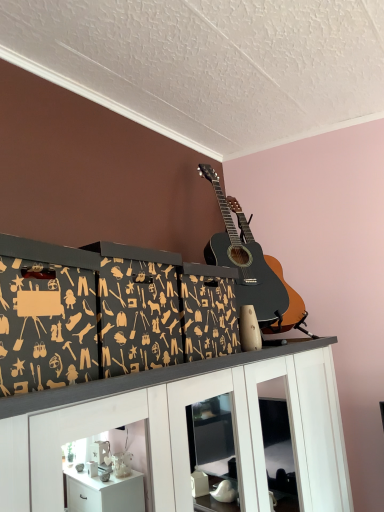
What do you see at coordinates (185, 429) in the screenshot? The height and width of the screenshot is (512, 384). I see `white glossy cabinet at upper center` at bounding box center [185, 429].

Measure the distance between point (237, 295) and camera.

Point (237, 295) and camera are 5.76 feet apart from each other.

Find the location of `black acoustic guitar at upper center`. black acoustic guitar at upper center is located at coordinates (245, 263).

Measure the distance between black cardboard boxes at center and camera.

black cardboard boxes at center is 36.11 inches away from camera.

Find the location of `white glossy cabinet at upper center`. white glossy cabinet at upper center is located at coordinates pos(185,429).

From the image's perspective, which object appears higher, black cardboard boxes at center or white glossy cabinet at upper center?

black cardboard boxes at center, from the image's perspective.

Is point (110, 362) closer or farther from the camera than point (289, 340)?

Clearly, point (110, 362) is closer to the camera than point (289, 340).

Is white glossy cabinet at upper center at the back of black cardboard boxes at center?

No, black cardboard boxes at center is not facing the opposite direction of white glossy cabinet at upper center.

From a real-world perspective, is black cardboard boxes at center positioned under white glossy cabinet at upper center based on gravity?

No, from a real-world perspective, black cardboard boxes at center is not beneath white glossy cabinet at upper center.

Who is taller, black cardboard boxes at center or black acoustic guitar at upper center?

With more height is black acoustic guitar at upper center.

Who is bigger, black cardboard boxes at center or black acoustic guitar at upper center?

black acoustic guitar at upper center.

Is black cardboard boxes at center at the left side of black acoustic guitar at upper center?

Indeed, black cardboard boxes at center is positioned on the left side of black acoustic guitar at upper center.

Is black cardboard boxes at center aimed at black acoustic guitar at upper center?

No, black cardboard boxes at center is not turned towards black acoustic guitar at upper center.

Considering the relative sizes of black acoustic guitar at upper center and white glossy cabinet at upper center in the image provided, is black acoustic guitar at upper center taller than white glossy cabinet at upper center?

No.

Would you say black acoustic guitar at upper center is inside or outside white glossy cabinet at upper center?

black acoustic guitar at upper center is not inside white glossy cabinet at upper center, it's outside.

Is black acoustic guitar at upper center far from white glossy cabinet at upper center?

black acoustic guitar at upper center is near white glossy cabinet at upper center, not far away.

Can you confirm if black acoustic guitar at upper center is bigger than white glossy cabinet at upper center?

Actually, black acoustic guitar at upper center might be smaller than white glossy cabinet at upper center.

Is white glossy cabinet at upper center taller than black acoustic guitar at upper center?

Yes, white glossy cabinet at upper center is taller than black acoustic guitar at upper center.

Considering the positions of objects white glossy cabinet at upper center and black acoustic guitar at upper center in the image provided, who is more to the left, white glossy cabinet at upper center or black acoustic guitar at upper center?

white glossy cabinet at upper center is more to the left.

Is white glossy cabinet at upper center positioned far away from black acoustic guitar at upper center?

They are positioned close to each other.

Can you tell me how much white glossy cabinet at upper center and black cardboard boxes at center differ in facing direction?

1.27 degrees.

Does white glossy cabinet at upper center have a lesser height compared to black cardboard boxes at center?

In fact, white glossy cabinet at upper center may be taller than black cardboard boxes at center.

Between white glossy cabinet at upper center and black cardboard boxes at center, which one has smaller size?

Smaller between the two is black cardboard boxes at center.

Is white glossy cabinet at upper center oriented towards black cardboard boxes at center?

A: No, white glossy cabinet at upper center is not oriented towards black cardboard boxes at center.

How far apart are black acoustic guitar at upper center and black cardboard boxes at center?

black acoustic guitar at upper center is 19.45 inches away from black cardboard boxes at center.

From the image's perspective, which one is positioned lower, black acoustic guitar at upper center or black cardboard boxes at center?

black cardboard boxes at center appears lower in the image.

I want to click on shelf that is under the black acoustic guitar at upper center (from a real-world perspective), so click(104, 313).

Where is `cabinetry on the right of black cardboard boxes at center`? The image size is (384, 512). cabinetry on the right of black cardboard boxes at center is located at coordinates (185, 429).

At what (x,y) coordinates should I click in order to perform the action: click on shelf on the left side of black acoustic guitar at upper center. Please return your answer as a coordinate pair (x, y). Looking at the image, I should click on pos(104,313).

When comparing their distances from black cardboard boxes at center, does white glossy cabinet at upper center or black acoustic guitar at upper center seem closer?

The object closer to black cardboard boxes at center is white glossy cabinet at upper center.

Which object lies nearer to the anchor point black acoustic guitar at upper center, black cardboard boxes at center or white glossy cabinet at upper center?

black cardboard boxes at center is closer to black acoustic guitar at upper center.

When comparing their distances from white glossy cabinet at upper center, does black cardboard boxes at center or black acoustic guitar at upper center seem closer?

black cardboard boxes at center.

Which object lies nearer to the anchor point black cardboard boxes at center, black acoustic guitar at upper center or white glossy cabinet at upper center?

white glossy cabinet at upper center lies closer to black cardboard boxes at center than the other object.

Considering their positions, is white glossy cabinet at upper center positioned closer to black acoustic guitar at upper center than black cardboard boxes at center?

black cardboard boxes at center.

Estimate the real-world distances between objects in this image. Which object is further from white glossy cabinet at upper center, black acoustic guitar at upper center or black cardboard boxes at center?

black acoustic guitar at upper center lies further to white glossy cabinet at upper center than the other object.

At what (x,y) coordinates should I click in order to perform the action: click on shelf located between white glossy cabinet at upper center and black acoustic guitar at upper center in the depth direction. Please return your answer as a coordinate pair (x, y). This screenshot has width=384, height=512. Looking at the image, I should click on (104, 313).